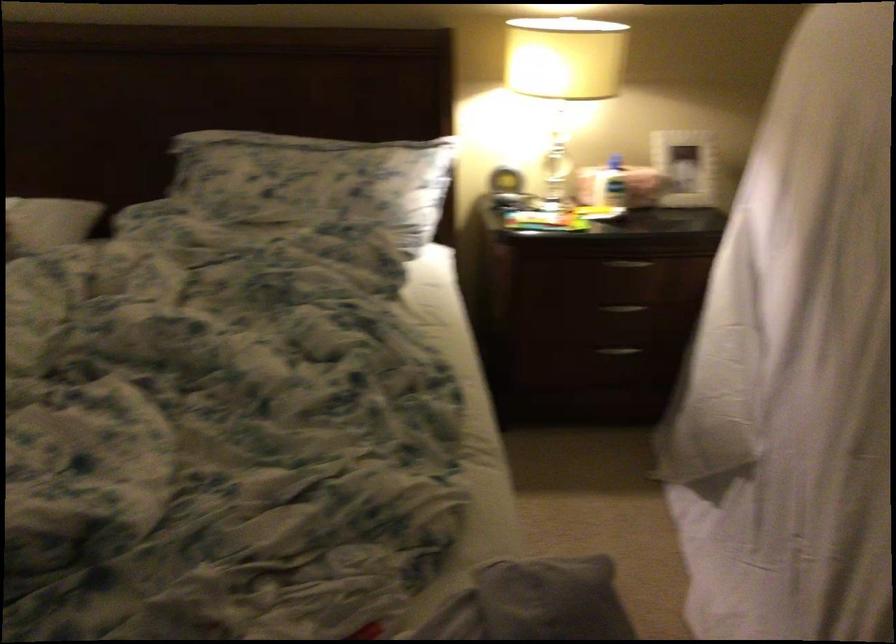
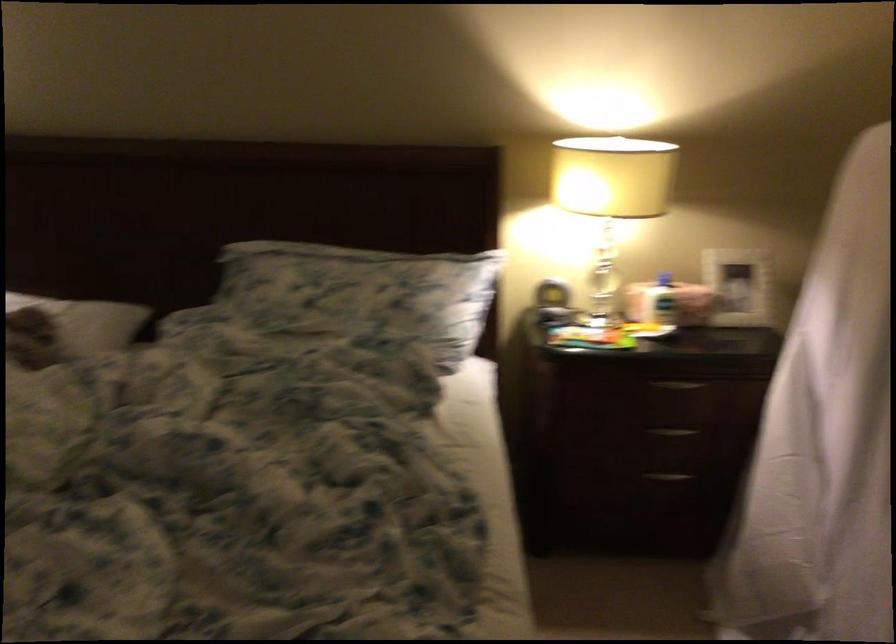
Locate, in the second image, the point that corresponds to (x=612, y=162) in the first image.

(664, 279)